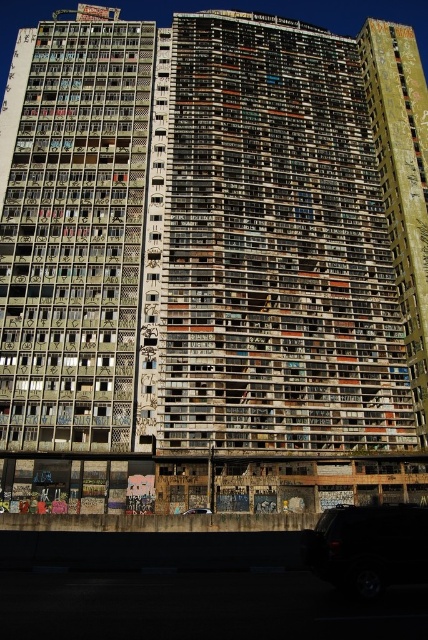
You are a delivery driver who needs to park your vehicle in the parking lot near the residential building. You have a shiny black suv at lower right and a black matte car at lower center. Which vehicle will require more space to park?

The shiny black suv at lower right is bigger than the black matte car at lower center, so it will require more space to park.

You are standing in front of the residential building and want to take a photo. You notice two points marked on the building. Which point, point [350,528] or point [181,513], is closer to your camera lens?

Point [350,528] is closer to the camera than point [181,513].